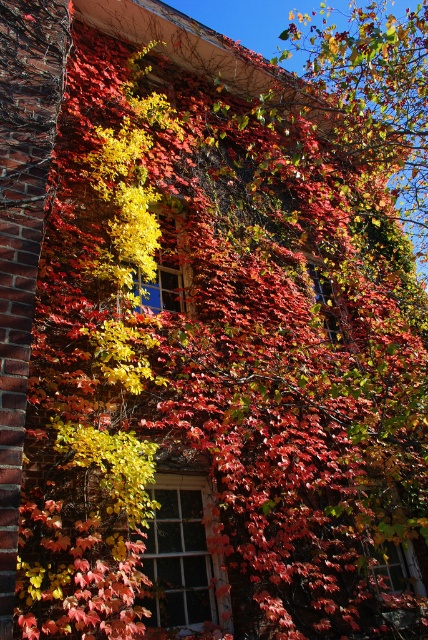
Question: Does white wooden window at center lie in front of transparent glass window at center?

Choices:
 (A) no
 (B) yes

Answer: (B)

Question: Estimate the real-world distances between objects in this image. Which object is closer to the white wooden window at center?

Choices:
 (A) transparent glass window at center
 (B) blue glass window at center

Answer: (B)

Question: Which point is farther to the camera?

Choices:
 (A) blue glass window at center
 (B) transparent glass window at center

Answer: (B)

Question: Is blue glass window at center to the left of transparent glass window at center from the viewer's perspective?

Choices:
 (A) yes
 (B) no

Answer: (A)

Question: Does white wooden window at center have a greater width compared to blue glass window at center?

Choices:
 (A) no
 (B) yes

Answer: (B)

Question: Which of the following is the closest to the observer?

Choices:
 (A) transparent glass window at center
 (B) blue glass window at center

Answer: (B)